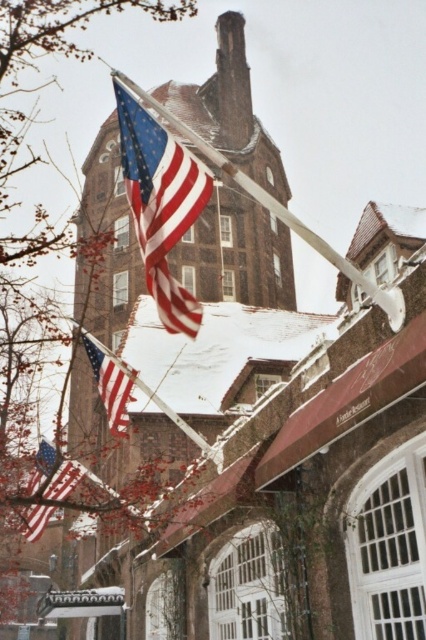
Question: Does matte red flag at upper center appear over matte red flag at lower left?

Choices:
 (A) yes
 (B) no

Answer: (A)

Question: Which point appears closest to the camera in this image?

Choices:
 (A) (213, 451)
 (B) (46, 472)
 (C) (103, 355)
 (D) (267, 205)

Answer: (D)

Question: Among these objects, which one is farthest from the camera?

Choices:
 (A) metallic flag pole at upper center
 (B) metallic silver flag pole at center

Answer: (B)

Question: Which of the following is the closest to the observer?

Choices:
 (A) metallic silver flag pole at center
 (B) metallic flag pole at upper center
 (C) matte red flag at center
 (D) matte red flag at lower left

Answer: (B)

Question: Can you confirm if matte red flag at lower left is positioned below matte red flag at center?

Choices:
 (A) no
 (B) yes

Answer: (B)

Question: From the image, what is the correct spatial relationship of metallic flag pole at upper center in relation to metallic silver flag pole at center?

Choices:
 (A) right
 (B) left

Answer: (A)